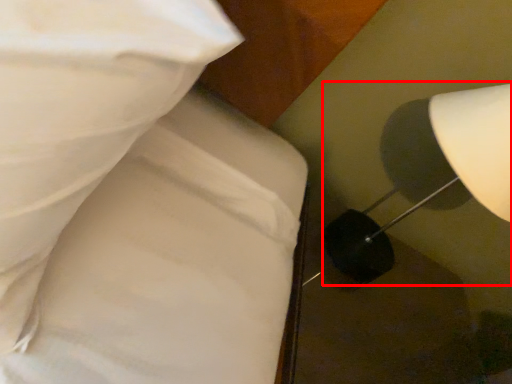
Question: In this image, where is lamp (annotated by the red box) located relative to bed?

Choices:
 (A) left
 (B) right

Answer: (B)